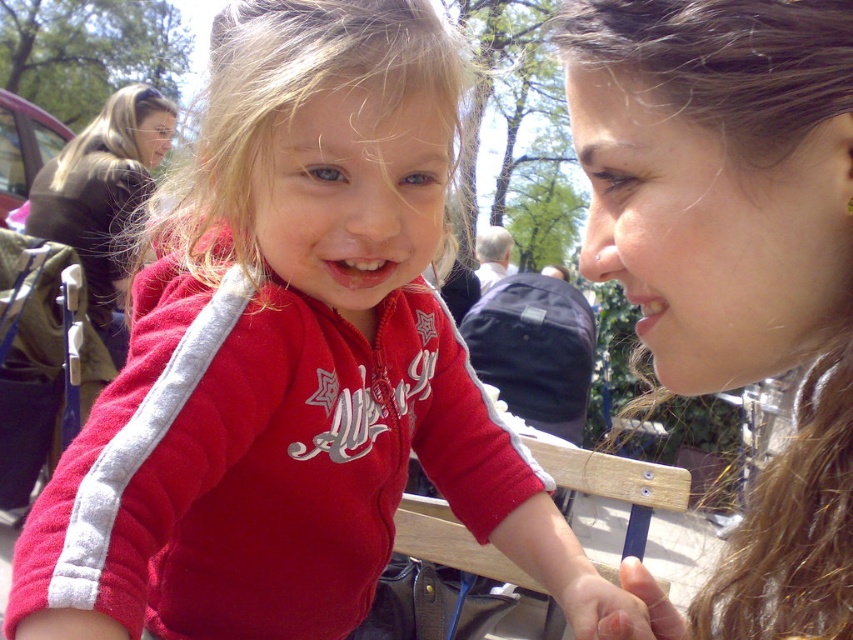
Looking at this image, based on the scene described, where is the matte red jacket at center located in relation to the matte skin face at upper left?

The matte red jacket at center is to the right of the matte skin face at upper left.

You are a photographer trying to capture a portrait of the brown leather jacket at upper left and the matte skin face at upper left. Which object is located to the left of the other?

The brown leather jacket at upper left is positioned on the left side of matte skin face at upper left.

You are a photographer trying to capture a candid shot of the two people in the image. You want to ensure both the smooth brown hair at center and the brown leather jacket at upper left are in focus. Which object should you focus on first to ensure depth of field covers both?

The smooth brown hair at center should be focused on first since it is closer to the camera than the brown leather jacket at upper left, ensuring the depth of field will include both.